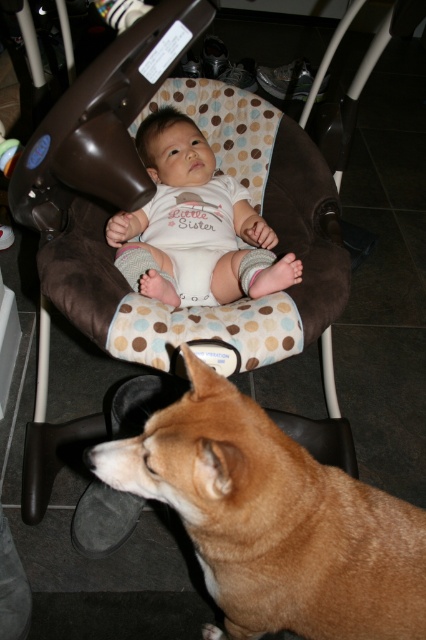
Question: Which object is positioned farthest from the white cotton onesie at center?

Choices:
 (A) brown fabric baby carriage at upper center
 (B) brown fur dog at lower center

Answer: (B)

Question: From the image, what is the correct spatial relationship of brown fabric baby carriage at upper center in relation to white cotton onesie at center?

Choices:
 (A) above
 (B) below

Answer: (A)

Question: Considering the real-world distances, which object is closest to the brown fabric baby carriage at upper center?

Choices:
 (A) brown fur dog at lower center
 (B) white cotton onesie at center

Answer: (B)

Question: Does brown fabric baby carriage at upper center have a greater width compared to white cotton onesie at center?

Choices:
 (A) yes
 (B) no

Answer: (A)

Question: Which point appears closest to the camera in this image?

Choices:
 (A) (181, 428)
 (B) (245, 221)
 (C) (75, 280)

Answer: (A)

Question: Is brown fabric baby carriage at upper center to the right of brown fur dog at lower center from the viewer's perspective?

Choices:
 (A) yes
 (B) no

Answer: (B)